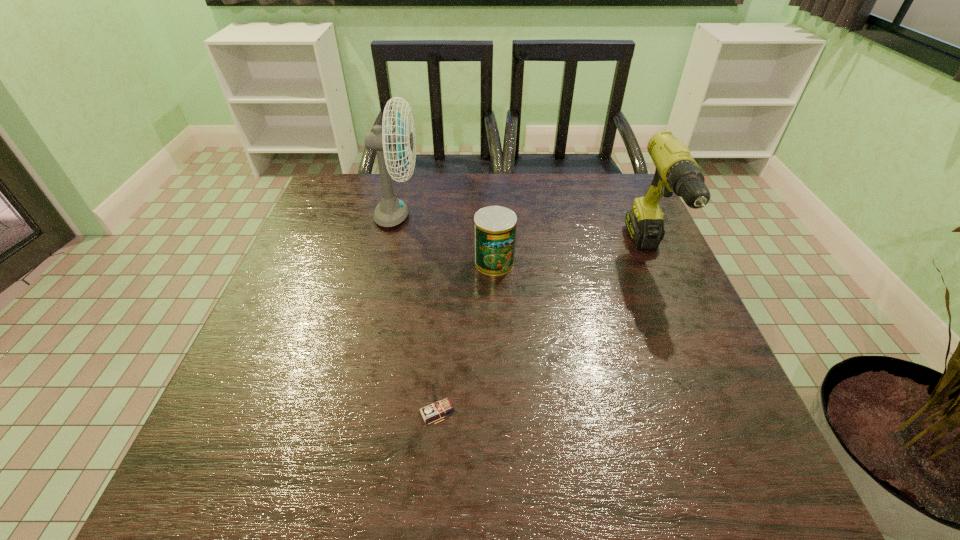
This screenshot has width=960, height=540. What are the coordinates of `free spot that satisfies the following two spatial constraints: 1. on the front-facing side of the matchbox; 2. on the right side of the fan` in the screenshot? It's located at (351, 411).

This screenshot has height=540, width=960. I want to click on free space that satisfies the following two spatial constraints: 1. on the back side of the nearest object; 2. on the front-facing side of the fan, so click(x=452, y=218).

Where is `free space in the image that satisfies the following two spatial constraints: 1. on the front-facing side of the nearest object; 2. on the right side of the fan`? The height and width of the screenshot is (540, 960). free space in the image that satisfies the following two spatial constraints: 1. on the front-facing side of the nearest object; 2. on the right side of the fan is located at coordinates (351, 411).

Locate an element on the screen. This screenshot has height=540, width=960. vacant point that satisfies the following two spatial constraints: 1. on the front-facing side of the can; 2. on the left side of the fan is located at coordinates (387, 262).